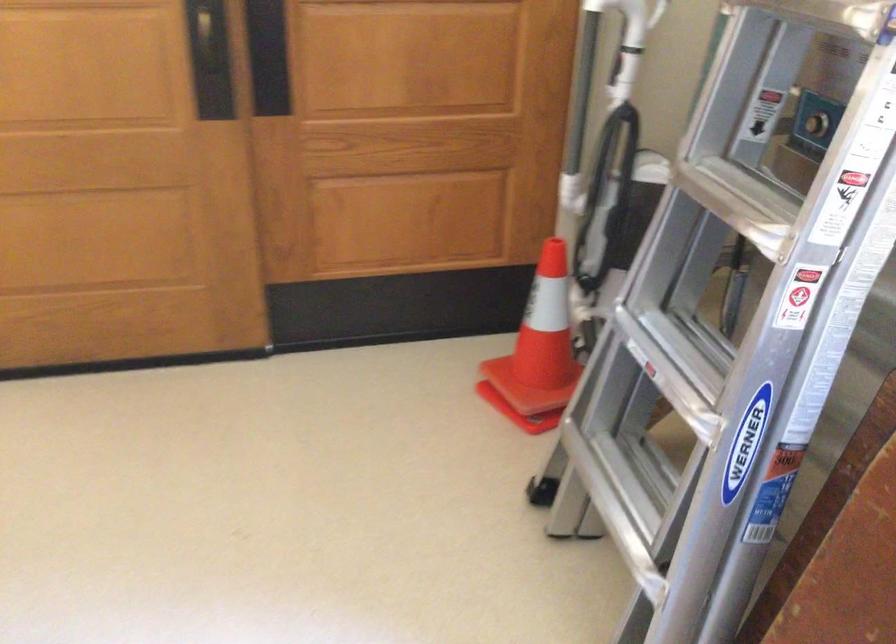
This screenshot has height=644, width=896. What do you see at coordinates (630, 24) in the screenshot? I see `the vacuum cleaner handle` at bounding box center [630, 24].